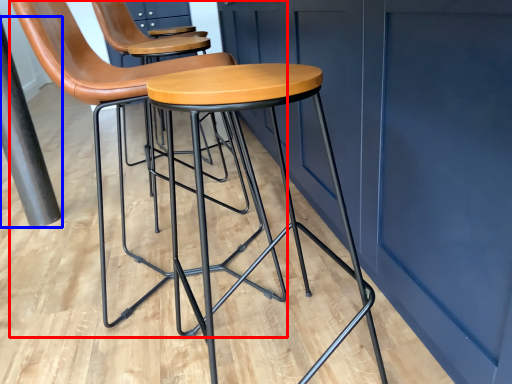
Question: Which of the following is the closest to the observer, chair (highlighted by a red box) or pole (highlighted by a blue box)?

Choices:
 (A) chair
 (B) pole

Answer: (A)